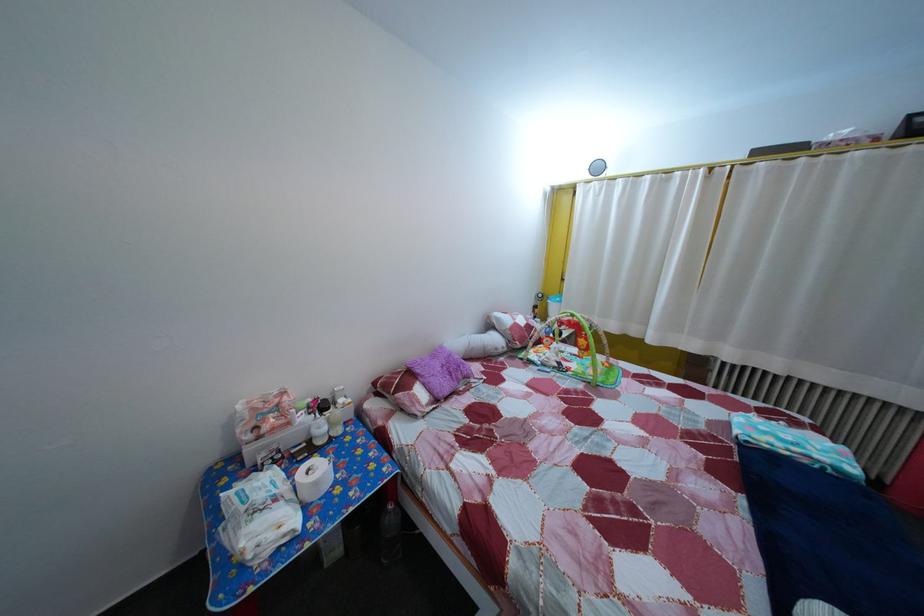
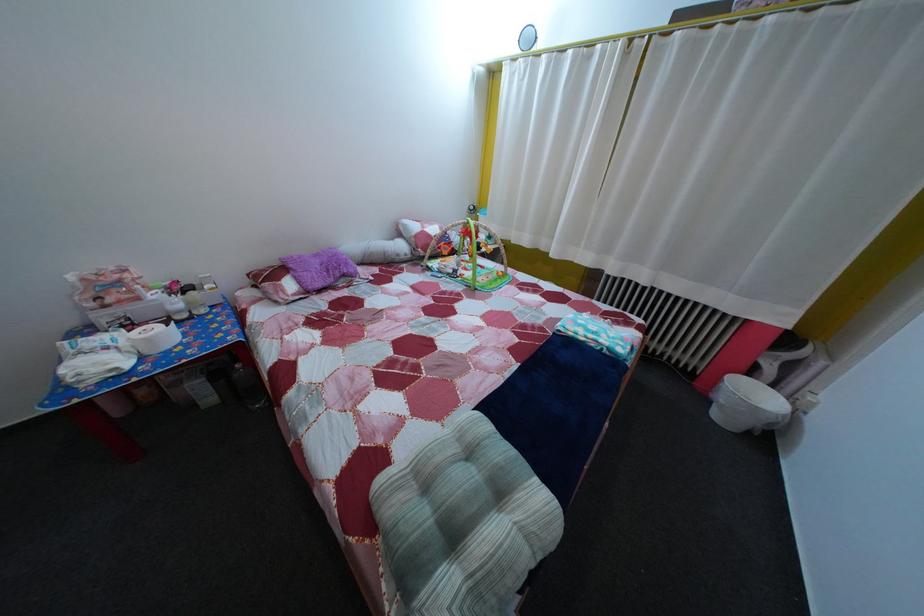
Where in the second image is the point corresponding to (764,444) from the first image?

(578, 334)